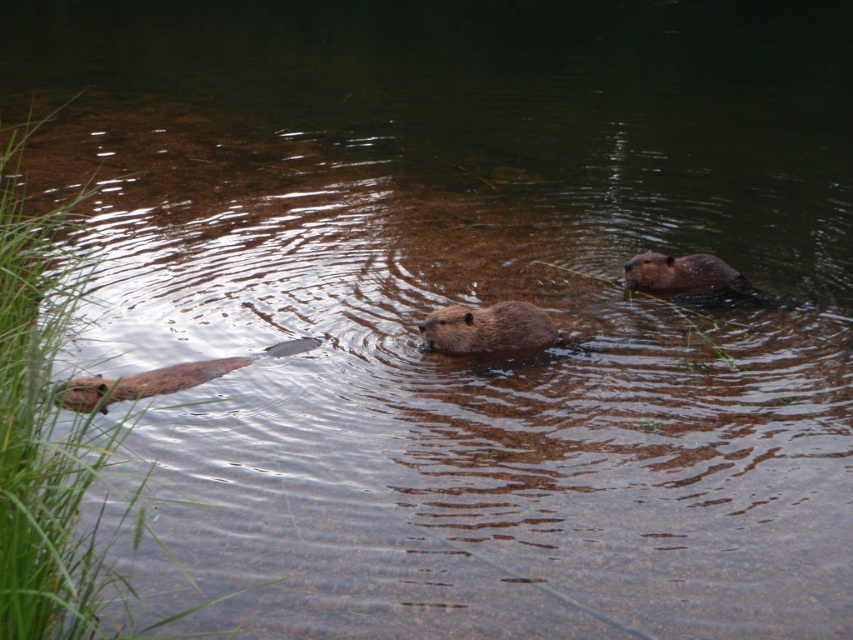
Can you confirm if brown furry beaver at center is wider than brown furry beaver at upper right?

In fact, brown furry beaver at center might be narrower than brown furry beaver at upper right.

Who is higher up, brown furry beaver at center or brown furry beaver at upper right?

Positioned higher is brown furry beaver at upper right.

This screenshot has height=640, width=853. What are the coordinates of `brown furry beaver at center` in the screenshot? It's located at (486, 326).